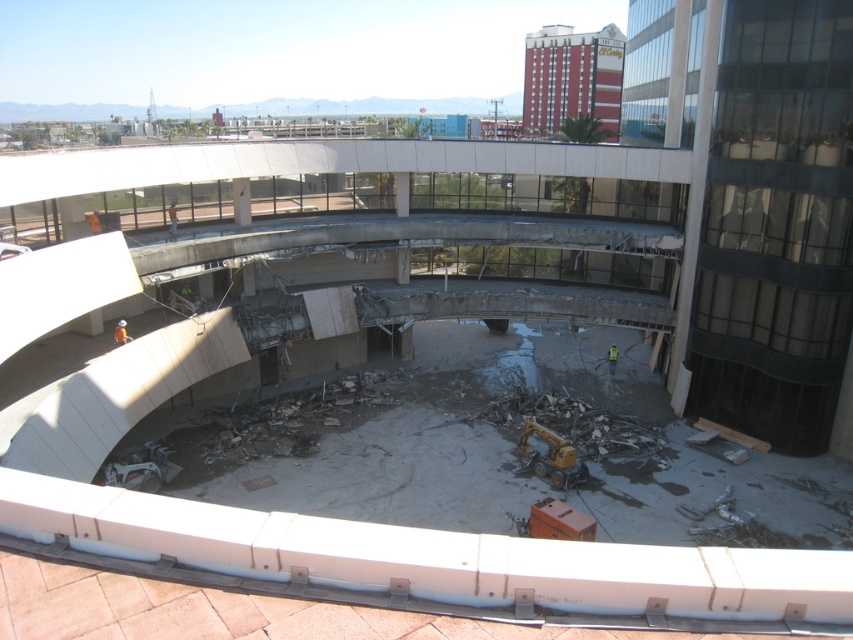
You are standing at the construction site and want to move from the point closer to you to the point further away. Which path would you take between the two points, point [115,340] and point [614,353]?

The path from point [115,340] to point [614,353] would involve moving away from the viewer since point [115,340] is closer to the viewer than point [614,353].

You are a drone operator tasked with delivering a tool to a worker located at the orange safety vest at lower center. The coordinates of the worker are given as point 0.520, 0.143. If your drone is currently at the center of the image, which direction should you fly to reach the worker?

The orange safety vest at lower center is located at coordinates (120,332). Since the worker is at lower center, the drone should fly downward from the center to reach them.